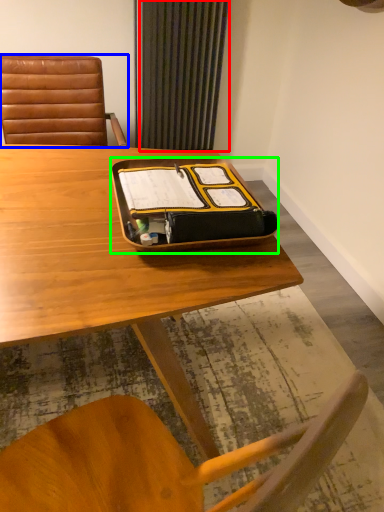
Question: Which object is positioned farthest from curtain (highlighted by a red box)? Select from chair (highlighted by a blue box) and tray (highlighted by a green box).

Choices:
 (A) chair
 (B) tray

Answer: (B)